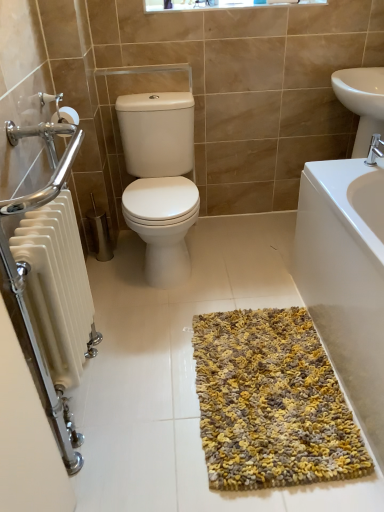
Identify the location of free spot above yellow-grey shaggy rug at center (from a real-world perspective). (274, 372).